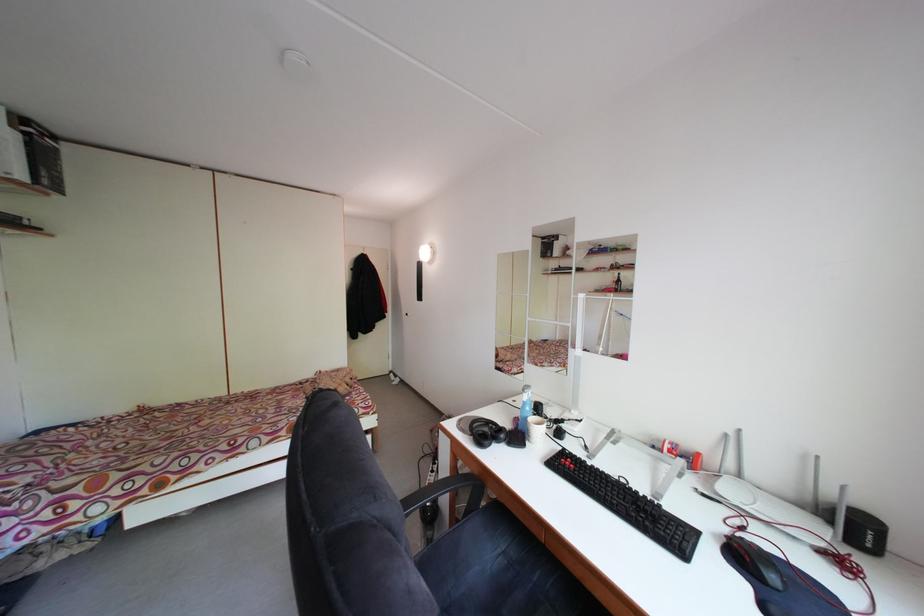
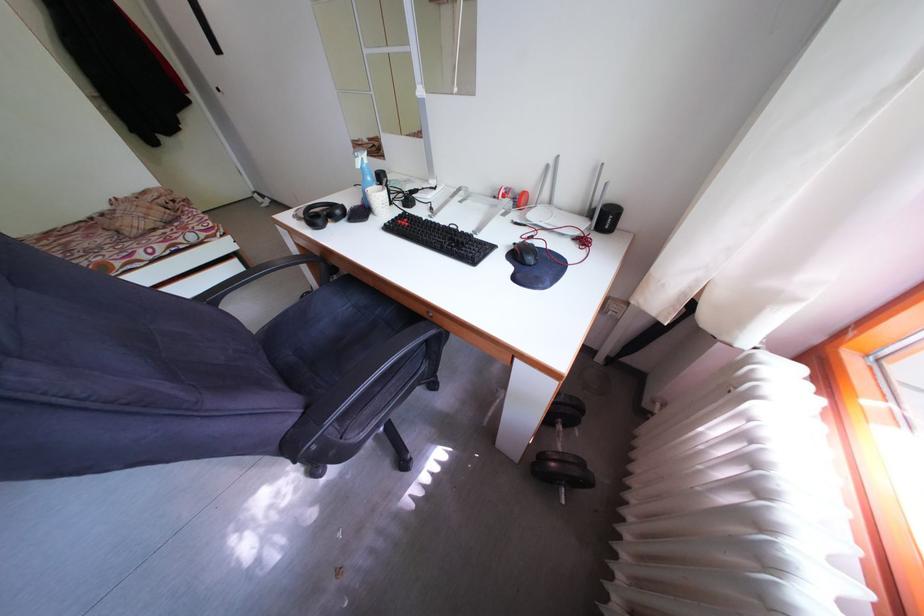
Locate, in the second image, the point that corresponds to the point at 831,519 in the first image.

(599, 220)